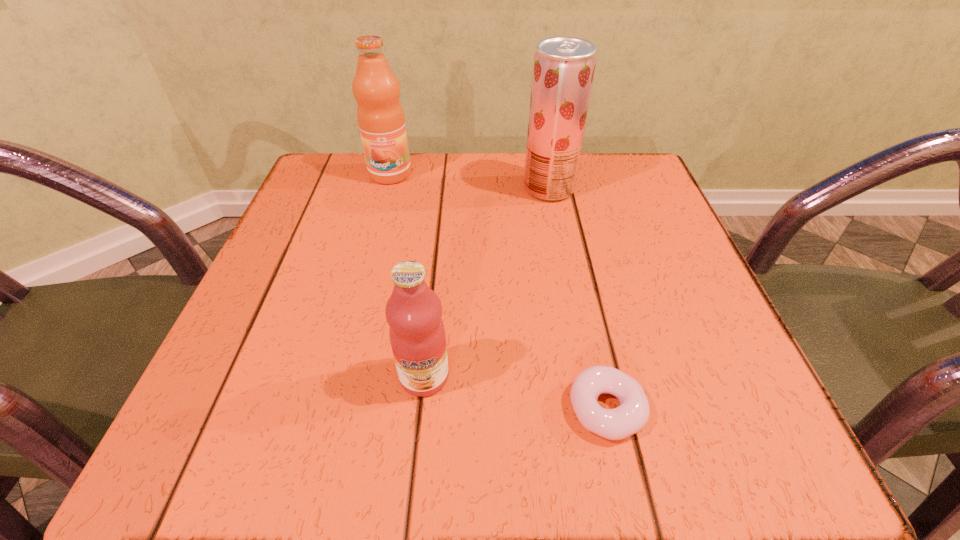
Where is `object located in the left edge section of the desktop`? object located in the left edge section of the desktop is located at coordinates (380, 115).

Where is `object present at the right edge`? The image size is (960, 540). object present at the right edge is located at coordinates (631, 416).

Image resolution: width=960 pixels, height=540 pixels. Identify the location of object positioned at the far left corner. (380, 115).

Find the location of `object at the near right corner`. object at the near right corner is located at coordinates (631, 416).

Locate an element on the screen. The image size is (960, 540). vacant space at the far edge is located at coordinates (451, 182).

You are a GUI agent. You are given a task and a screenshot of the screen. Output one action in this format:
    pyautogui.click(x=<x>, y=<y>)
    Task: Click on the vacant space at the near edge of the desktop
    Image resolution: width=960 pixels, height=540 pixels.
    Given the screenshot: What is the action you would take?
    pyautogui.click(x=476, y=403)

In the image, there is a desktop. Where is `free space at the left edge`? The image size is (960, 540). free space at the left edge is located at coordinates (309, 376).

At what (x,y) coordinates should I click in order to perform the action: click on free point at the right edge. Please return your answer as a coordinate pair (x, y). This screenshot has height=540, width=960. Looking at the image, I should click on (640, 313).

Where is `blank area at the far left corner`? The image size is (960, 540). blank area at the far left corner is located at coordinates (323, 167).

In the image, there is a desktop. In order to click on vacant region at the near right corner in this screenshot , I will do `click(754, 421)`.